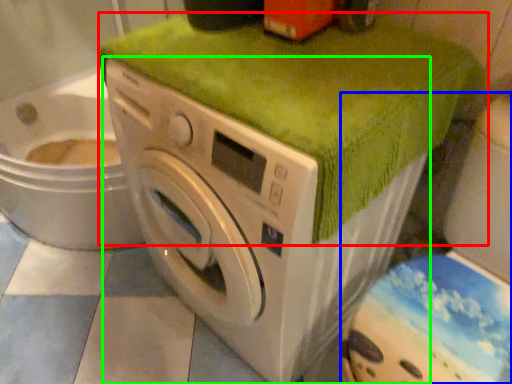
Question: Which is farther away from bath towel (highlighted by a red box)? washer (highlighted by a blue box) or washing machine (highlighted by a green box)?

Choices:
 (A) washer
 (B) washing machine

Answer: (A)